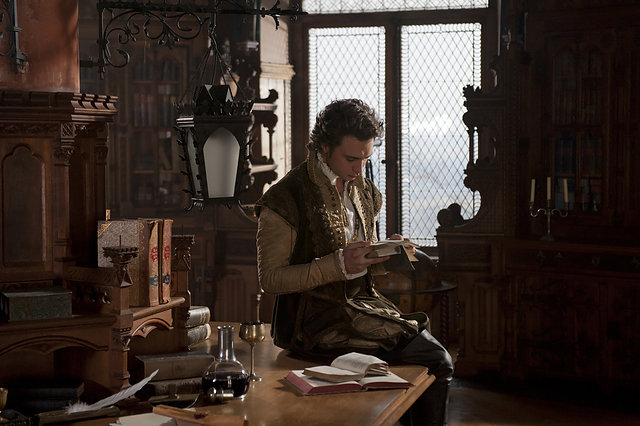
Where is `windowframe`? windowframe is located at coordinates (392, 99), (303, 114), (427, 253).